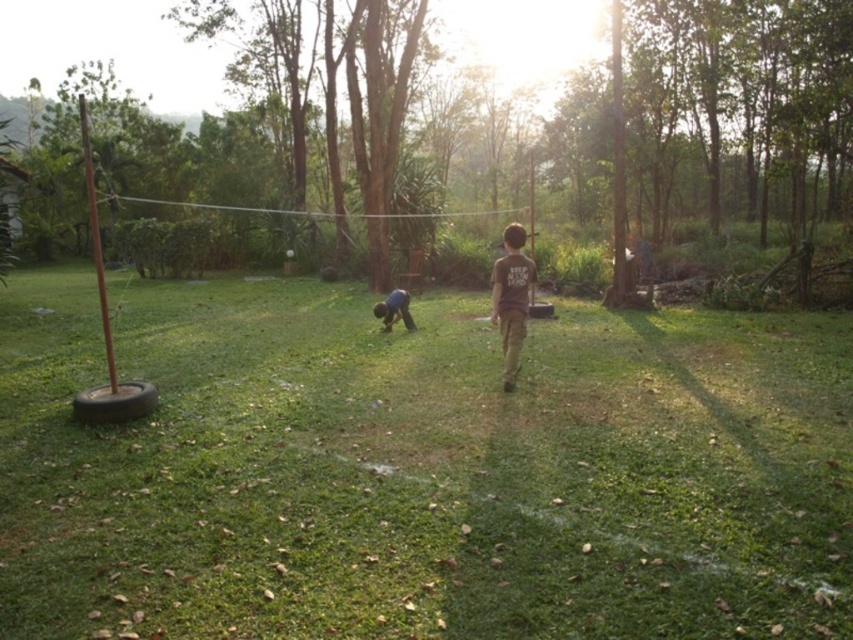
Question: Is brown cotton shirt at center above dark blue fabric at center?

Choices:
 (A) yes
 (B) no

Answer: (A)

Question: Does brown cotton shirt at center appear under dark blue fabric at center?

Choices:
 (A) no
 (B) yes

Answer: (A)

Question: Can you confirm if green grass at center is bigger than dark blue fabric at center?

Choices:
 (A) yes
 (B) no

Answer: (A)

Question: Considering the real-world distances, which object is closest to the brown cotton shirt at center?

Choices:
 (A) dark blue fabric at center
 (B) green grass at center

Answer: (B)

Question: Which of the following is the closest to the observer?

Choices:
 (A) (407, 483)
 (B) (521, 278)

Answer: (A)

Question: Which object appears closest to the camera in this image?

Choices:
 (A) brown cotton shirt at center
 (B) green grass at center

Answer: (B)